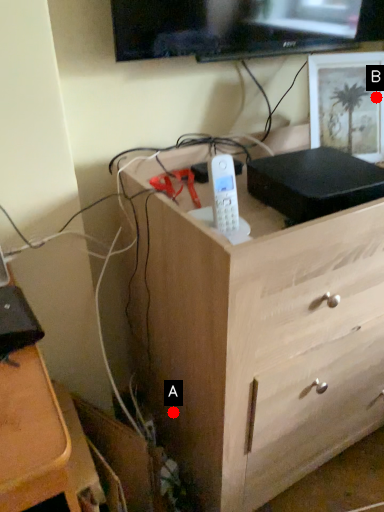
Question: Two points are circled on the image, labeled by A and B beside each circle. Which point is further to the camera?

Choices:
 (A) A is further
 (B) B is further

Answer: (A)